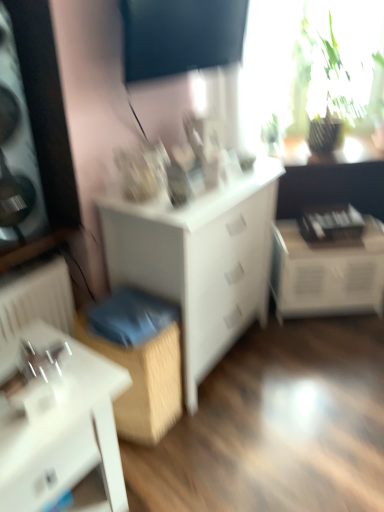
Question: Would you say dark matte screen at upper center, placed as the first window screen when sorted from left to right, is to the left or to the right of green leafy plant at upper right, the first window screen in the back-to-front sequence, in the picture?

Choices:
 (A) left
 (B) right

Answer: (A)

Question: Does point (195, 41) appear closer or farther from the camera than point (382, 31)?

Choices:
 (A) closer
 (B) farther

Answer: (A)

Question: Which is nearer to the green leafy plant at upper right, the first window screen in the back-to-front sequence?

Choices:
 (A) white matte chest of drawers at center
 (B) dark matte screen at upper center, which ranks as the second window screen in back-to-front order
 (C) white glossy table at lower right, the first table from the right
 (D) white glossy table at lower left, the second table from the right
 (E) wooden box at lower center

Answer: (B)

Question: Which object is positioned farthest from the wooden box at lower center?

Choices:
 (A) white glossy table at lower right, which is the 1th table in back-to-front order
 (B) white matte chest of drawers at center
 (C) dark matte screen at upper center, which appears as the first window screen when viewed from the front
 (D) white glossy table at lower left, marked as the first table in a left-to-right arrangement
 (E) green leafy plant at upper right, which is counted as the second window screen, starting from the front

Answer: (E)